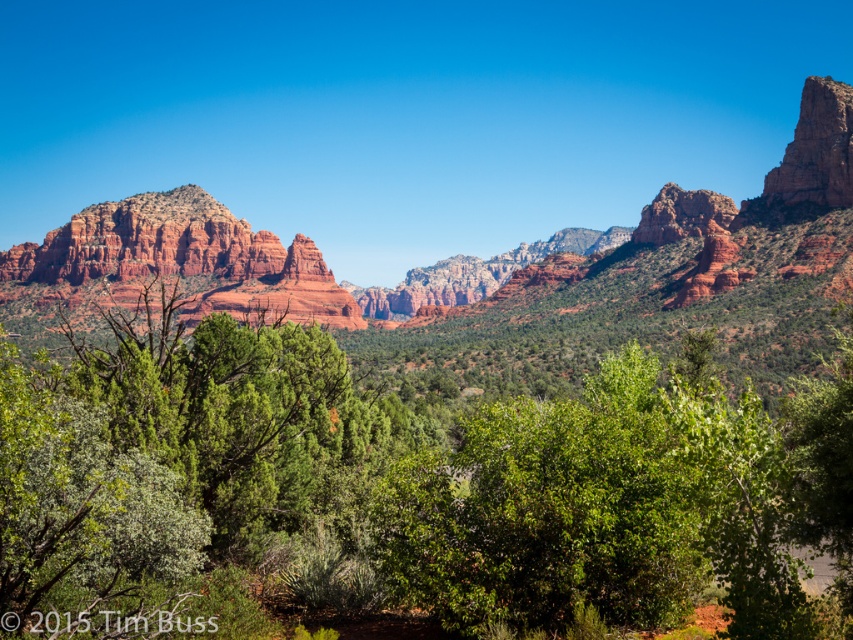
You are standing at the point marked by point (412, 484) in the desert landscape. Looking around, you see the green leafy tree at center. Which direction should you walk to reach the nearest red rock formation?

The point (412, 484) marks the green leafy tree at center, so you are already at the tree. To reach the nearest red rock formation, you would need to walk towards the midground or background where the red rock formations are located, as the foreground has green shrubs and trees.